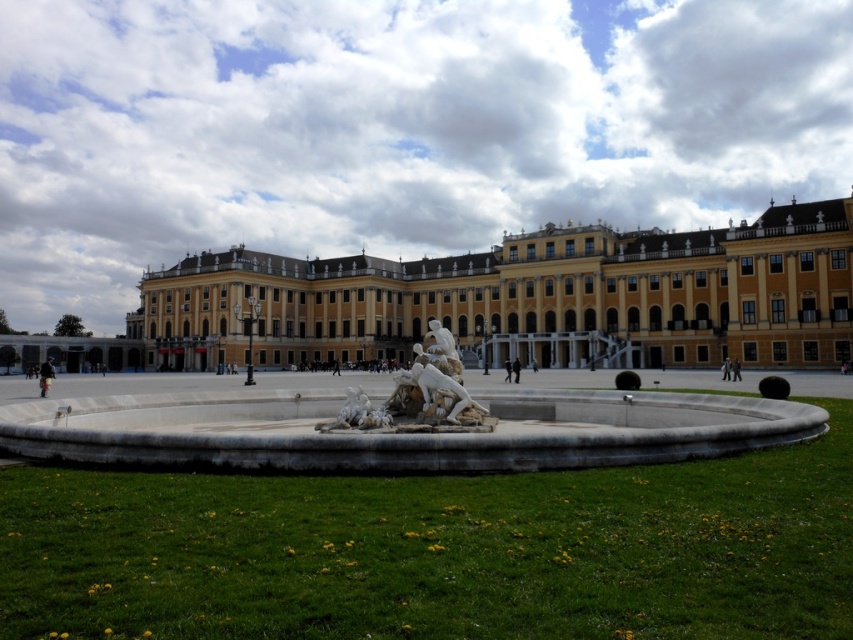
You are an architect visiting the site of the yellow stone palace at center and the white marble sculpture at center. You need to determine which structure is taller to plan your next project. Based on the scene, which one is taller?

The yellow stone palace at center is taller than the white marble sculpture at center according to the description.

You are standing in front of a yellow stone palace at center and want to take a photo of it. Considering the distance between you and the palace is 70.06 meters, would you need a zoom lens to capture the entire building in one frame?

The distance between you and the yellow stone palace at center is 70.06 meters. To capture the entire building in one frame from that distance, a zoom lens would likely be necessary to ensure the palace fits within the camera frame without being too small or cropped.

You are standing in front of the yellow stone palace at center and the white marble fountain at center. Which one is higher from the ground?

The yellow stone palace at center is above the white marble fountain at center, so the yellow stone palace at center is higher from the ground.